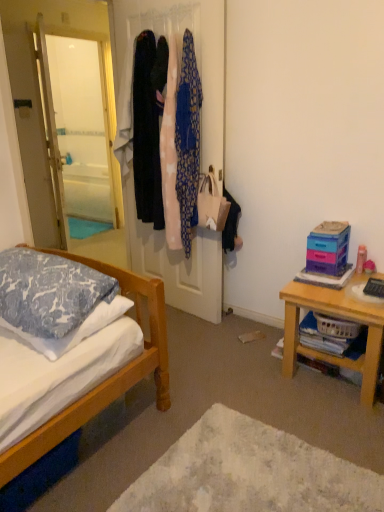
Question: From a real-world perspective, is blue patterned pillow at left, placed as the first pillow when sorted from top to bottom, physically above wooden table at right?

Choices:
 (A) yes
 (B) no

Answer: (A)

Question: From the image's perspective, is blue patterned pillow at left, the 2th pillow when ordered from bottom to top, on top of wooden table at right?

Choices:
 (A) yes
 (B) no

Answer: (A)

Question: Does blue patterned pillow at left, placed as the first pillow when sorted from top to bottom, have a greater width compared to wooden table at right?

Choices:
 (A) no
 (B) yes

Answer: (A)

Question: Does blue patterned pillow at left, placed as the first pillow when sorted from top to bottom, have a smaller size compared to wooden table at right?

Choices:
 (A) no
 (B) yes

Answer: (B)

Question: Does blue patterned pillow at left, the 2th pillow when ordered from bottom to top, lie in front of wooden table at right?

Choices:
 (A) yes
 (B) no

Answer: (A)

Question: From a real-world perspective, is blue patterned pillow at left, placed as the first pillow when sorted from top to bottom, physically below wooden table at right?

Choices:
 (A) no
 (B) yes

Answer: (A)

Question: From a real-world perspective, is blue patterned pillow at left, placed as the first pillow when sorted from top to bottom, over white soft rug at lower center?

Choices:
 (A) no
 (B) yes

Answer: (B)

Question: Could you tell me if blue patterned pillow at left, the 2th pillow when ordered from bottom to top, is turned towards white soft rug at lower center?

Choices:
 (A) yes
 (B) no

Answer: (B)

Question: Is blue patterned pillow at left, placed as the first pillow when sorted from top to bottom, in contact with white soft rug at lower center?

Choices:
 (A) no
 (B) yes

Answer: (A)

Question: Considering the relative sizes of blue patterned pillow at left, the 2th pillow when ordered from bottom to top, and white soft rug at lower center in the image provided, is blue patterned pillow at left, the 2th pillow when ordered from bottom to top, thinner than white soft rug at lower center?

Choices:
 (A) no
 (B) yes

Answer: (B)

Question: From the image's perspective, is blue patterned pillow at left, placed as the first pillow when sorted from top to bottom, on top of white soft rug at lower center?

Choices:
 (A) yes
 (B) no

Answer: (A)

Question: Can you confirm if blue patterned pillow at left, placed as the first pillow when sorted from top to bottom, is positioned to the left of white soft rug at lower center?

Choices:
 (A) yes
 (B) no

Answer: (A)

Question: Is pink fabric at center, positioned as the second clothing in left-to-right order, wider than silky fabric coats at center?

Choices:
 (A) no
 (B) yes

Answer: (B)